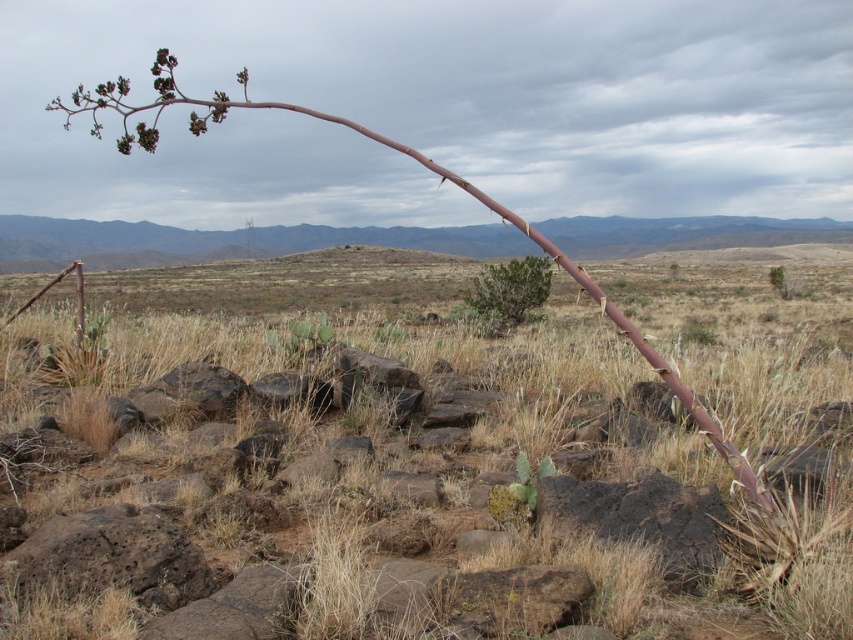
You are a hiker who wants to place a small tent on the ground. You see brown grass at center and green leafy bush at center. Which location would be better for placing the tent to avoid being under the bush?

The brown grass at center is positioned under the green leafy bush at center, so placing the tent on the brown grass at center would place it under the bush. Therefore, the better location is the area not under the green leafy bush at center, but since both objects are at center, you might need to look for another spot. However, based on the given options, the green leafy bush at center is above the brown grass at center, so placing the tent on the brown grass at center would be under the bush. Thus, the un

You are an archaeologist examining the image of the desert landscape. You need to locate the brown rough branch at left. Based on the coordinates provided, where would you find it in the image?

The brown rough branch at left is located at the 2D coordinates of point (418, 163) in the image.

Looking at this image, you are navigating through this desert landscape and need to place two markers at the coordinates provided. If you are facing north, which marker, point (563, 296) or point (233, 106), is closer to you?

Point (233, 106) is closer to you because it is in front of point (563, 296), which is behind it.